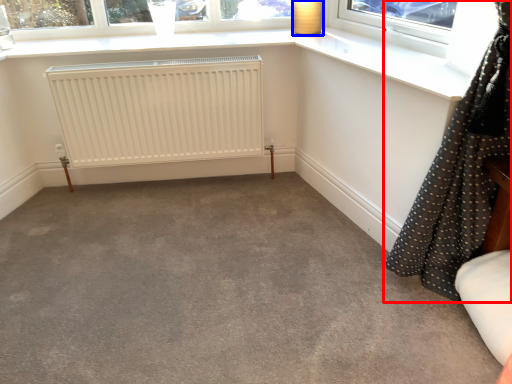
Question: Which object appears closest to the camera in this image, curtain (highlighted by a red box) or lamp (highlighted by a blue box)?

Choices:
 (A) curtain
 (B) lamp

Answer: (A)